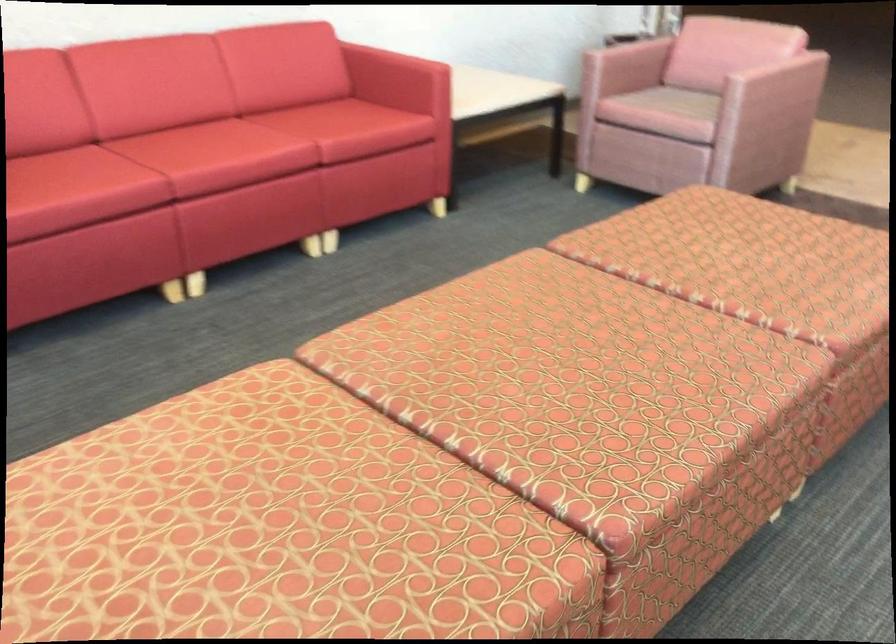
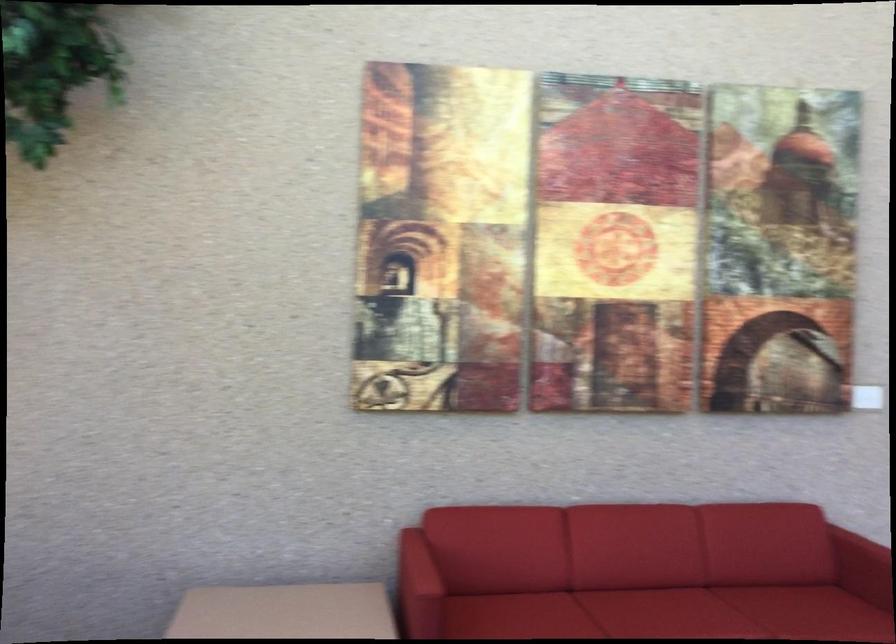
Locate, in the second image, the point that corresponds to (202,137) in the first image.

(659, 607)